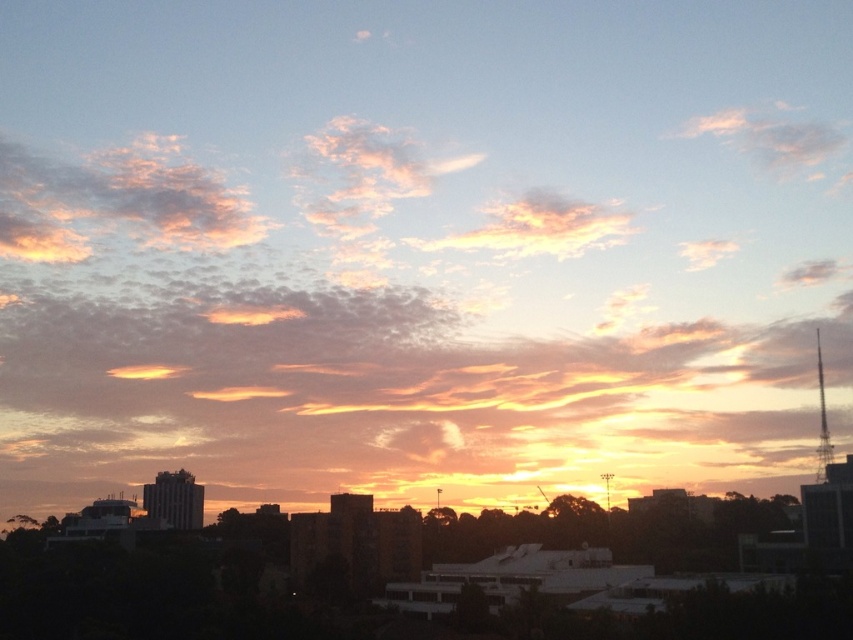
Question: Does golden-orange cotton clouds at center appear on the left side of pink fluffy cloud at upper right?

Choices:
 (A) no
 (B) yes

Answer: (B)

Question: Which point is closer to the camera?

Choices:
 (A) golden-orange cotton clouds at center
 (B) pastel cotton clouds at center

Answer: (A)

Question: Which point is closer to the camera?

Choices:
 (A) golden-orange cotton clouds at center
 (B) pink fluffy cloud at upper right
 (C) pastel cotton clouds at center
 (D) pastel pink cotton clouds at upper left

Answer: (A)

Question: Does pastel pink cotton clouds at upper left lie behind pink fluffy cloud at upper right?

Choices:
 (A) yes
 (B) no

Answer: (B)

Question: Does pastel pink cotton clouds at upper left come behind pink fluffy cloud at upper right?

Choices:
 (A) no
 (B) yes

Answer: (A)

Question: Among these objects, which one is farthest from the camera?

Choices:
 (A) pastel cotton clouds at center
 (B) pastel pink cotton clouds at upper left
 (C) golden-orange cotton clouds at center

Answer: (B)